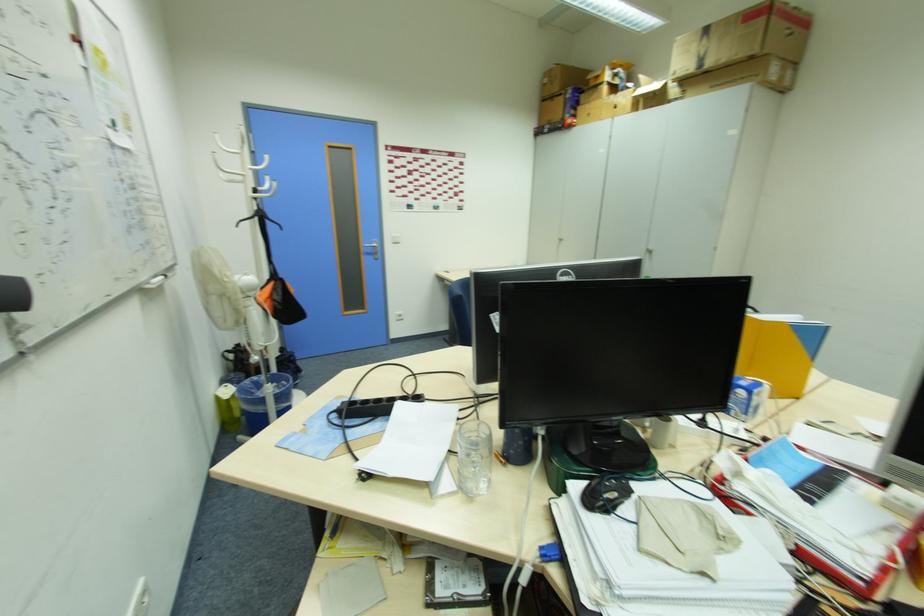
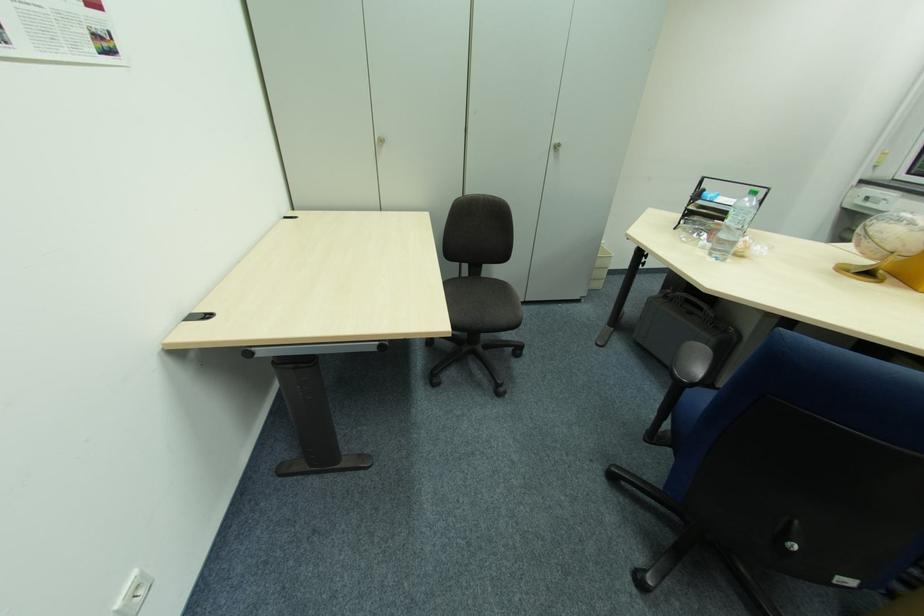
Find the pixel in the second image that matches pixel 650 254 in the first image.

(554, 150)